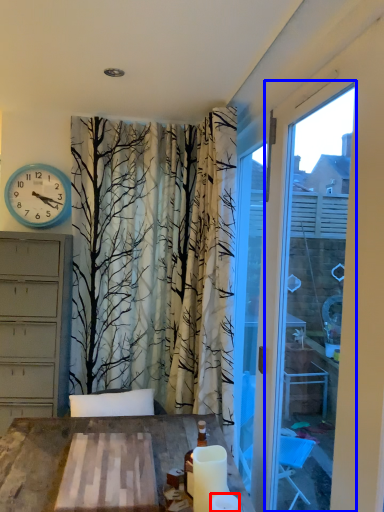
Question: Which object appears closest to the camera in this image, candle (highlighted by a red box) or window frame (highlighted by a blue box)?

Choices:
 (A) candle
 (B) window frame

Answer: (B)